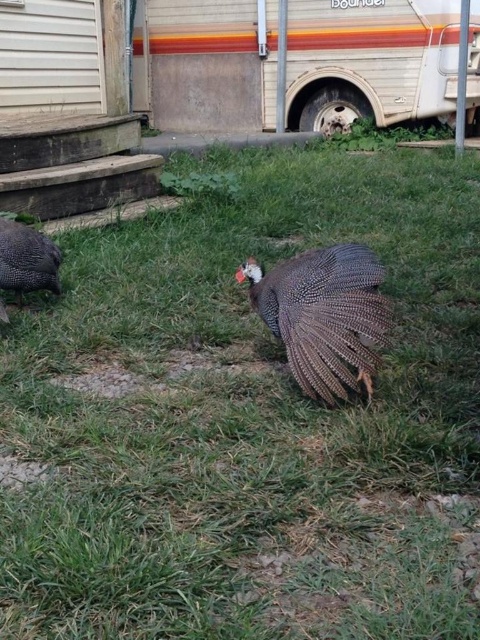
Does rustic wood recreational vehicle at center appear over brown speckled turkey at left?

Indeed, rustic wood recreational vehicle at center is positioned over brown speckled turkey at left.

Does rustic wood recreational vehicle at center appear on the left side of brown speckled turkey at left?

In fact, rustic wood recreational vehicle at center is to the right of brown speckled turkey at left.

Looking at this image, measure the distance between point (x=355, y=32) and camera.

A distance of 21.89 feet exists between point (x=355, y=32) and camera.

Locate an element on the screen. rustic wood recreational vehicle at center is located at coordinates (371, 60).

Is brown speckled feathers at center wider than brown speckled turkey at left?

Correct, the width of brown speckled feathers at center exceeds that of brown speckled turkey at left.

Between point (268, 326) and point (27, 230), which one is positioned in front?

Point (268, 326)

Does point (360, 333) lie behind point (45, 276)?

No.

At what (x,y) coordinates should I click in order to perform the action: click on brown speckled feathers at center. Please return your answer as a coordinate pair (x, y). The width and height of the screenshot is (480, 640). Looking at the image, I should click on (324, 316).

What do you see at coordinates (371, 60) in the screenshot?
I see `rustic wood recreational vehicle at center` at bounding box center [371, 60].

You are a GUI agent. You are given a task and a screenshot of the screen. Output one action in this format:
    pyautogui.click(x=<x>, y=<y>)
    Task: Click on the rustic wood recreational vehicle at center
    
    Given the screenshot: What is the action you would take?
    (371, 60)

Is point (156, 76) closer to camera compared to point (351, 291)?

No, it is not.

Find the location of a particular element. This screenshot has width=480, height=640. rustic wood recreational vehicle at center is located at coordinates (371, 60).